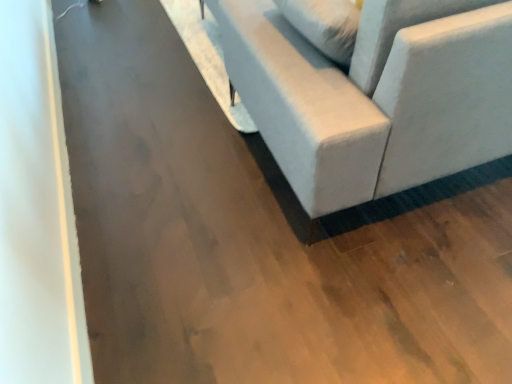
This screenshot has height=384, width=512. In order to click on textured fabric couch at center in this screenshot , I will do `click(374, 99)`.

Describe the element at coordinates (374, 99) in the screenshot. I see `textured fabric couch at center` at that location.

This screenshot has height=384, width=512. What are the coordinates of `textured fabric couch at center` in the screenshot? It's located at (374, 99).